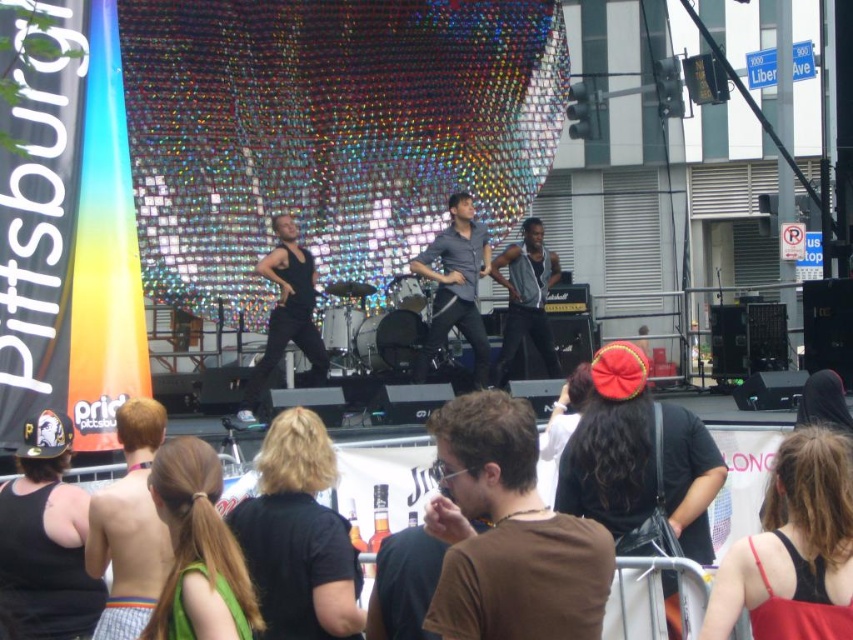
Who is higher up, black matte tank top at center or metallic silver vest at center?

metallic silver vest at center is above.

Does black matte tank top at center have a lesser width compared to metallic silver vest at center?

In fact, black matte tank top at center might be wider than metallic silver vest at center.

Based on the photo, measure the distance between point [254,378] and camera.

Point [254,378] and camera are 90.30 meters apart.

This screenshot has height=640, width=853. In order to click on black matte tank top at center in this screenshot , I will do `click(286, 314)`.

Between point (450, 202) and point (254, 380), which one is positioned in front?

Point (254, 380) is more forward.

Does matte gray shirt at center have a lesser width compared to black matte tank top at center?

Indeed, matte gray shirt at center has a lesser width compared to black matte tank top at center.

The height and width of the screenshot is (640, 853). What are the coordinates of `matte gray shirt at center` in the screenshot? It's located at (456, 285).

Is brown matte shirt at center to the right of matte gray shirt at center from the viewer's perspective?

Correct, you'll find brown matte shirt at center to the right of matte gray shirt at center.

Which is more to the left, brown matte shirt at center or matte gray shirt at center?

Positioned to the left is matte gray shirt at center.

You are a GUI agent. You are given a task and a screenshot of the screen. Output one action in this format:
    pyautogui.click(x=<x>, y=<y>)
    Task: Click on the brown matte shirt at center
    
    Given the screenshot: What is the action you would take?
    pyautogui.click(x=508, y=532)